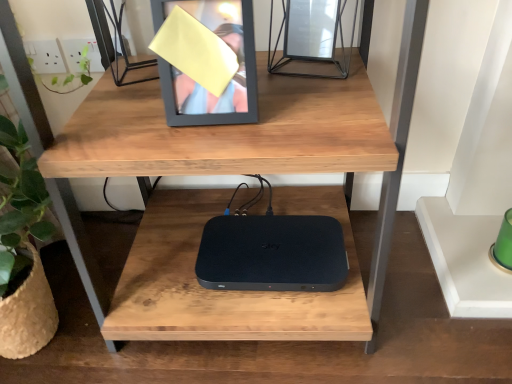
Image resolution: width=512 pixels, height=384 pixels. What do you see at coordinates (272, 253) in the screenshot? I see `black matte/solid sky box at center` at bounding box center [272, 253].

You are a GUI agent. You are given a task and a screenshot of the screen. Output one action in this format:
    pyautogui.click(x=<x>, y=<y>)
    Task: Click on the black matte/solid sky box at center
    
    Given the screenshot: What is the action you would take?
    pos(272,253)

Measure the distance between point (245,249) and camera.

Point (245,249) is 38.07 inches from camera.

What do you see at coordinates (199, 84) in the screenshot?
I see `matte black picture frame at upper center` at bounding box center [199, 84].

At what (x,y) coordinates should I click in order to perform the action: click on matte black picture frame at upper center. Please return your answer as a coordinate pair (x, y). Looking at the image, I should click on (199, 84).

Identify the location of black matte/solid sky box at center. (272, 253).

Can you confirm if black matte/solid sky box at center is positioned to the left of matte black picture frame at upper center?

In fact, black matte/solid sky box at center is to the right of matte black picture frame at upper center.

Is black matte/solid sky box at center in front of or behind matte black picture frame at upper center in the image?

Clearly, black matte/solid sky box at center is behind matte black picture frame at upper center.

Which is closer, (x=273, y=263) or (x=213, y=114)?

Point (x=273, y=263) is positioned farther from the camera compared to point (x=213, y=114).

From the image's perspective, is black matte/solid sky box at center above or below matte black picture frame at upper center?

black matte/solid sky box at center is below matte black picture frame at upper center.

From a real-world perspective, who is located higher, black matte/solid sky box at center or matte black picture frame at upper center?

In real-world perspective, matte black picture frame at upper center is above.

Is black matte/solid sky box at center wider or thinner than matte black picture frame at upper center?

Clearly, black matte/solid sky box at center has more width compared to matte black picture frame at upper center.

Is black matte/solid sky box at center shorter than matte black picture frame at upper center?

Yes.

Considering the sizes of objects black matte/solid sky box at center and matte black picture frame at upper center in the image provided, who is bigger, black matte/solid sky box at center or matte black picture frame at upper center?

matte black picture frame at upper center.

Does black matte/solid sky box at center contain matte black picture frame at upper center?

Actually, matte black picture frame at upper center is outside black matte/solid sky box at center.

Is black matte/solid sky box at center not close to matte black picture frame at upper center?

No, black matte/solid sky box at center is not far from matte black picture frame at upper center.

Is black matte/solid sky box at center positioned with its back to matte black picture frame at upper center?

No, black matte/solid sky box at center is not facing away from matte black picture frame at upper center.

Can you tell me how much black matte/solid sky box at center and matte black picture frame at upper center differ in facing direction?

black matte/solid sky box at center and matte black picture frame at upper center are facing 1.98 degrees away from each other.

The width and height of the screenshot is (512, 384). I want to click on computer that appears behind the matte black picture frame at upper center, so click(x=272, y=253).

Would you say matte black picture frame at upper center is to the left or to the right of black matte/solid sky box at center in the picture?

Based on their positions, matte black picture frame at upper center is located to the left of black matte/solid sky box at center.

Is matte black picture frame at upper center further to camera compared to black matte/solid sky box at center?

No.

Which is less distant, (242, 75) or (258, 251)?

The point (242, 75) is more forward.

From the image's perspective, which object appears higher, matte black picture frame at upper center or black matte/solid sky box at center?

matte black picture frame at upper center.

From a real-world perspective, who is located higher, matte black picture frame at upper center or black matte/solid sky box at center?

matte black picture frame at upper center, from a real-world perspective.

In terms of width, does matte black picture frame at upper center look wider or thinner when compared to black matte/solid sky box at center?

Considering their sizes, matte black picture frame at upper center looks slimmer than black matte/solid sky box at center.

Does matte black picture frame at upper center have a greater height compared to black matte/solid sky box at center?

Yes, matte black picture frame at upper center is taller than black matte/solid sky box at center.

Is matte black picture frame at upper center bigger or smaller than black matte/solid sky box at center?

In the image, matte black picture frame at upper center appears to be larger than black matte/solid sky box at center.

Is black matte/solid sky box at center located within matte black picture frame at upper center?

Definitely not — black matte/solid sky box at center is not inside matte black picture frame at upper center.

Is matte black picture frame at upper center positioned far away from black matte/solid sky box at center?

No, matte black picture frame at upper center is not far from black matte/solid sky box at center.

Could you tell me if matte black picture frame at upper center is turned towards black matte/solid sky box at center?

No, matte black picture frame at upper center does not turn towards black matte/solid sky box at center.

Identify the location of picture frame above the black matte/solid sky box at center (from a real-world perspective). The height and width of the screenshot is (384, 512). (199, 84).

Where is `computer to the right of matte black picture frame at upper center`? The width and height of the screenshot is (512, 384). computer to the right of matte black picture frame at upper center is located at coordinates (272, 253).

You are a GUI agent. You are given a task and a screenshot of the screen. Output one action in this format:
    pyautogui.click(x=<x>, y=<y>)
    Task: Click on the computer that appears below the matte black picture frame at upper center (from the image's perspective)
    The height and width of the screenshot is (384, 512).
    Given the screenshot: What is the action you would take?
    pyautogui.click(x=272, y=253)